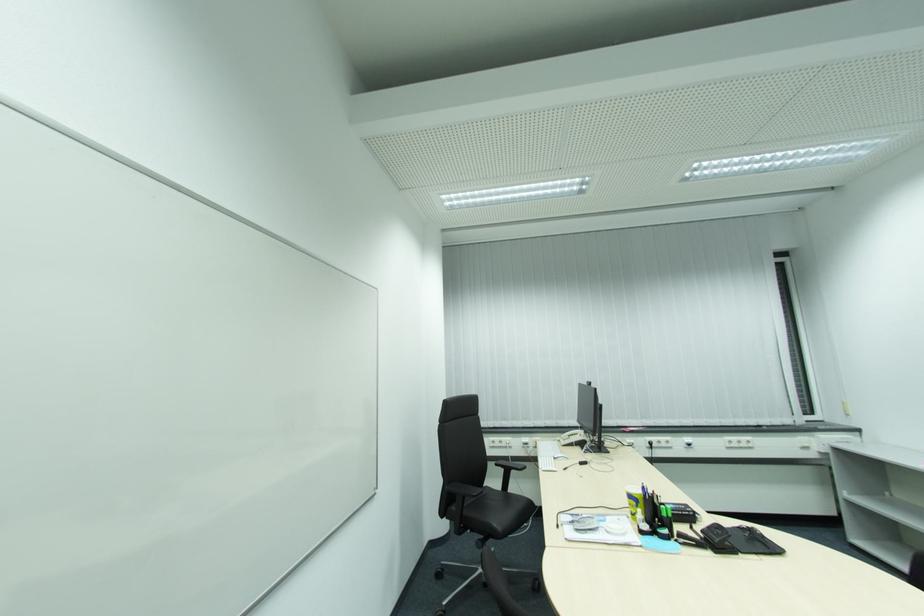
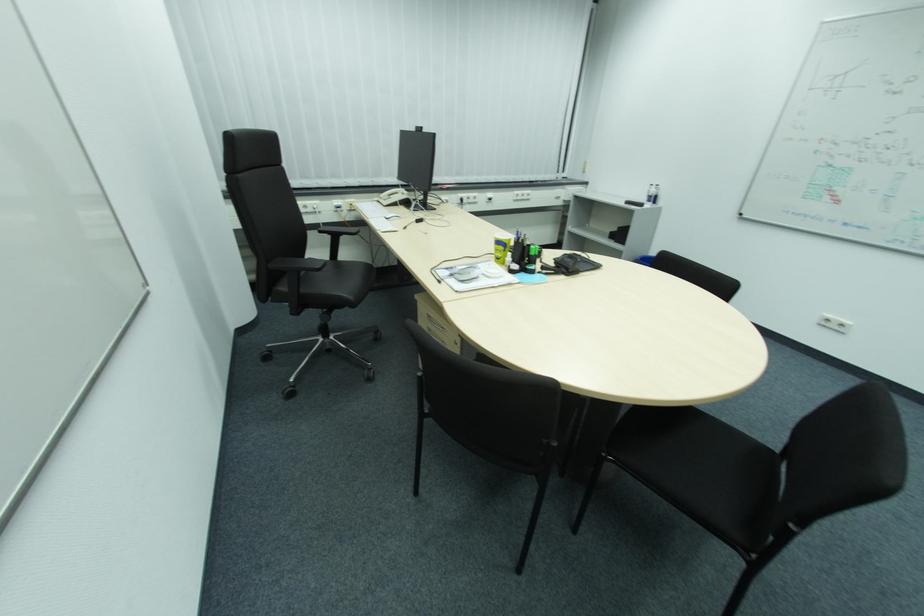
The point at (x=491, y=485) is marked in the first image. Where is the corresponding point in the second image?

(311, 257)